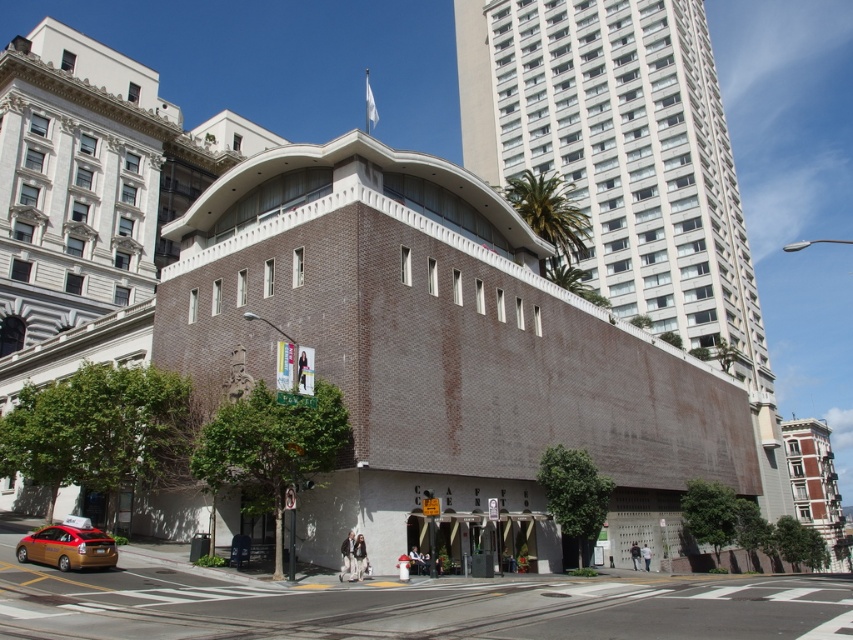
Question: Can you confirm if smooth beige building at center is wider than gold metallic taxi at lower left?

Choices:
 (A) yes
 (B) no

Answer: (A)

Question: Which point is closer to the camera taking this photo?

Choices:
 (A) (793, 506)
 (B) (527, 113)
 (C) (437, 342)

Answer: (C)

Question: Which point is farther to the camera?

Choices:
 (A) smooth beige building at center
 (B) gold metallic taxi at lower left
 (C) red brick building at right

Answer: (C)

Question: Does red brick building at right have a smaller size compared to gold metallic taxi at lower left?

Choices:
 (A) yes
 (B) no

Answer: (B)

Question: Does red brick building at right appear over gold metallic taxi at lower left?

Choices:
 (A) yes
 (B) no

Answer: (B)

Question: Which of the following is the closest to the observer?

Choices:
 (A) (97, 556)
 (B) (297, 234)
 (C) (642, 198)
 (D) (814, 506)

Answer: (A)